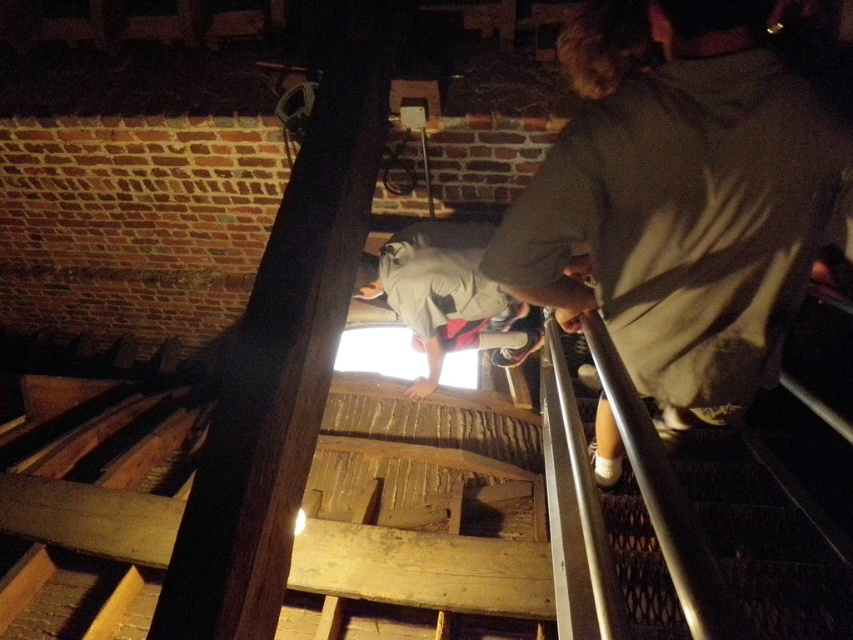
Does dark wood beam at center lie in front of gray fabric shirt at center?

Yes, it is.

Who is positioned more to the right, dark wood beam at center or gray fabric shirt at center?

Positioned to the right is gray fabric shirt at center.

Which is behind, point (345, 10) or point (503, 301)?

Point (503, 301)

The width and height of the screenshot is (853, 640). Identify the location of dark wood beam at center. (283, 352).

Is dark brown shirt at center thinner than gray fabric shirt at center?

Correct, dark brown shirt at center's width is less than gray fabric shirt at center's.

Who is more forward, (624, 132) or (492, 228)?

Positioned in front is point (624, 132).

Who is more distant from viewer, (668, 72) or (425, 225)?

Point (425, 225)

Find the location of a particular element. Image resolution: width=853 pixels, height=640 pixels. dark brown shirt at center is located at coordinates (682, 198).

Which is more to the right, dark brown shirt at center or dark wood beam at center?

Positioned to the right is dark brown shirt at center.

In the scene shown: Does dark brown shirt at center appear over dark wood beam at center?

No.

Where is `dark brown shirt at center`? The height and width of the screenshot is (640, 853). dark brown shirt at center is located at coordinates point(682,198).